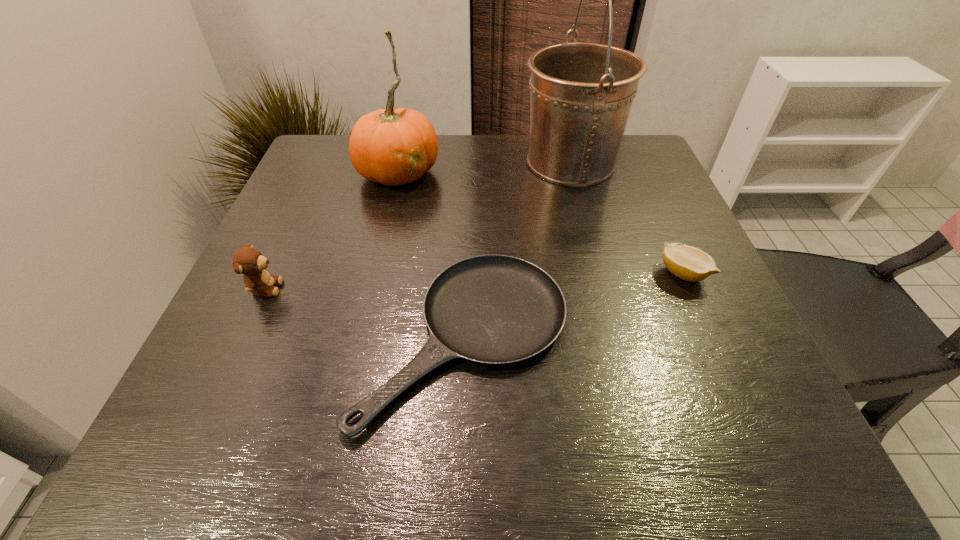
You are a GUI agent. You are given a task and a screenshot of the screen. Output one action in this format:
    pyautogui.click(x=<x>, y=<y>)
    Task: Click on the free space between the teddy bear and the frying pan
    
    Given the screenshot: What is the action you would take?
    pyautogui.click(x=365, y=313)

The width and height of the screenshot is (960, 540). Find the location of `free spot between the teddy bear and the tallest object`. free spot between the teddy bear and the tallest object is located at coordinates (419, 225).

Identify the location of unoccupied area between the tallest object and the lemon. Image resolution: width=960 pixels, height=540 pixels. (627, 218).

Where is `empty location between the tallest object and the second tallest object`? This screenshot has height=540, width=960. empty location between the tallest object and the second tallest object is located at coordinates (485, 167).

Select which object appears as the fourth closest to the tallest object. Please provide its 2D coordinates. Your answer should be formatted as a tuple, i.e. [(x, y)], where the tuple contains the x and y coordinates of a point satisfying the conditions above.

[(252, 264)]

Locate which object is the closest to the teddy bear. Please provide its 2D coordinates. Your answer should be formatted as a tuple, i.e. [(x, y)], where the tuple contains the x and y coordinates of a point satisfying the conditions above.

[(494, 309)]

Where is `free spot that satisfies the following two spatial constraints: 1. on the front side of the second shortest object; 2. on the right side of the bucket`? This screenshot has height=540, width=960. free spot that satisfies the following two spatial constraints: 1. on the front side of the second shortest object; 2. on the right side of the bucket is located at coordinates (601, 273).